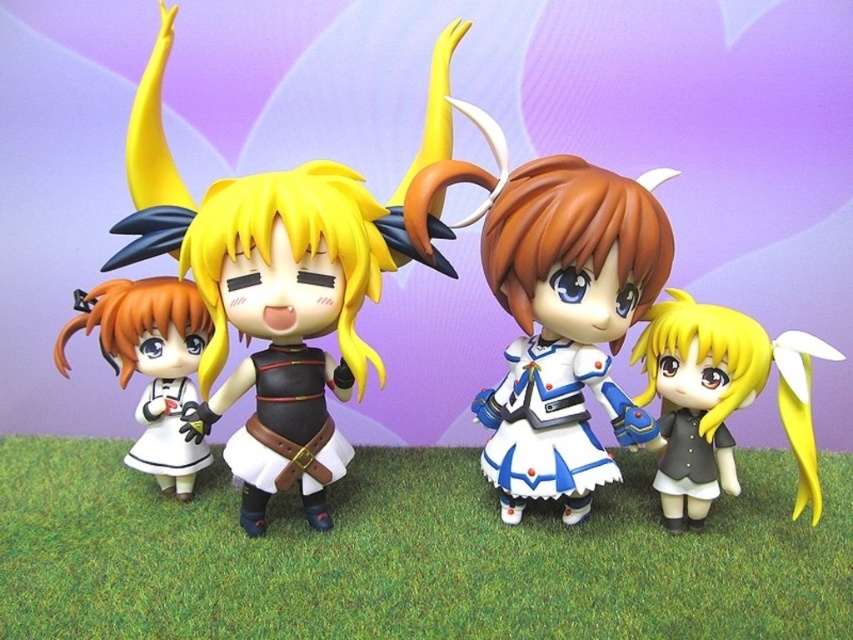
Is green grass at lower center thinner than matte black doll at center?

In fact, green grass at lower center might be wider than matte black doll at center.

Is point (769, 548) positioned after point (158, 100)?

No, (769, 548) is in front of (158, 100).

Does point (177, 520) lie behind point (228, 378)?

Yes, point (177, 520) is behind point (228, 378).

Image resolution: width=853 pixels, height=640 pixels. What are the coordinates of `green grass at lower center` in the screenshot? It's located at (409, 554).

Does green grass at lower center appear on the right side of satin white dress at center?

Incorrect, green grass at lower center is not on the right side of satin white dress at center.

Who is higher up, green grass at lower center or satin white dress at center?

satin white dress at center

Who is more forward, (396, 589) or (569, 340)?

Point (396, 589) is in front.

The height and width of the screenshot is (640, 853). I want to click on green grass at lower center, so click(x=409, y=554).

Which is below, green grass at lower center or matte black dress at center?

Positioned lower is green grass at lower center.

Can you confirm if green grass at lower center is smaller than matte black dress at center?

No.

Describe the element at coordinates (409, 554) in the screenshot. I see `green grass at lower center` at that location.

Find the location of a particular element. Image resolution: width=853 pixels, height=640 pixels. green grass at lower center is located at coordinates (409, 554).